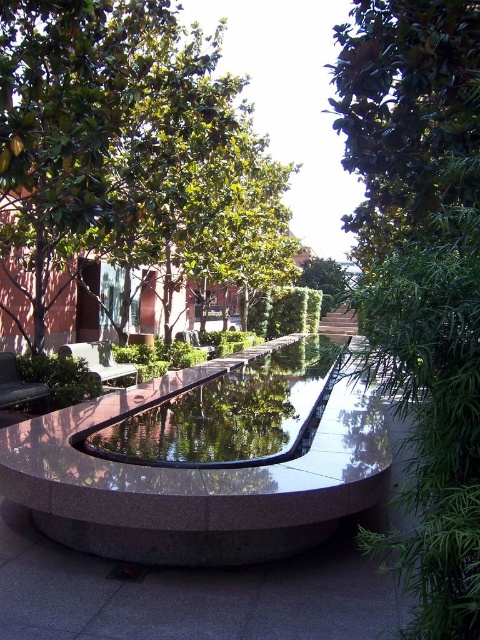
Question: Does green leafy tree at upper left appear on the right side of glossy concrete water at center?

Choices:
 (A) yes
 (B) no

Answer: (B)

Question: Which object appears closest to the camera in this image?

Choices:
 (A) green leafy tree at upper left
 (B) green metal bench at center
 (C) glossy concrete water at center

Answer: (C)

Question: Which of the following is the farthest from the observer?

Choices:
 (A) green leafy tree at center
 (B) glossy concrete pond at center
 (C) glossy concrete water at center
 (D) green metal bench at center

Answer: (D)

Question: Does green leafy tree at center appear on the right side of glossy concrete pond at center?

Choices:
 (A) yes
 (B) no

Answer: (A)

Question: Which object is the farthest from the glossy concrete pond at center?

Choices:
 (A) glossy concrete water at center
 (B) green leafy tree at center
 (C) green leafy tree at upper left

Answer: (C)

Question: Can you confirm if green leafy tree at upper left is bigger than green fabric bench at lower left?

Choices:
 (A) no
 (B) yes

Answer: (B)